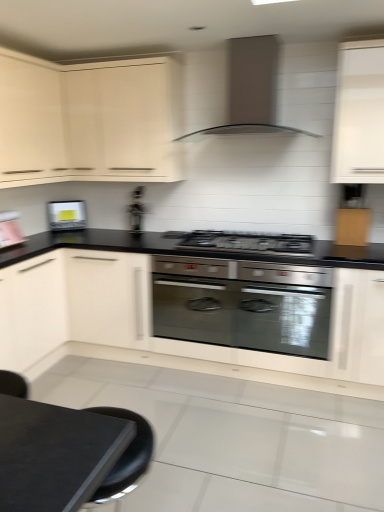
This screenshot has height=512, width=384. What do you see at coordinates (89, 120) in the screenshot?
I see `matte cream cabinet at upper left, arranged as the 2th cabinetry when viewed from the right` at bounding box center [89, 120].

Locate an element on the screen. The height and width of the screenshot is (512, 384). matte white cabinet at upper left, which appears as the 3th cabinetry when viewed from the right is located at coordinates (30, 120).

I want to click on matte black table at lower left, so click(55, 454).

From a real-world perspective, is matte white cabinet at upper left, which appears as the 3th cabinetry when viewed from the right, above or below white matte cabinet at lower left, placed as the 4th cabinetry when sorted from right to left?

matte white cabinet at upper left, which appears as the 3th cabinetry when viewed from the right, is situated higher than white matte cabinet at lower left, placed as the 4th cabinetry when sorted from right to left, in the real world.

Could you tell me if matte white cabinet at upper left, which ranks as the second cabinetry in left-to-right order, is facing white matte cabinet at lower left, which appears as the first cabinetry when viewed from the left?

No, matte white cabinet at upper left, which ranks as the second cabinetry in left-to-right order, does not turn towards white matte cabinet at lower left, which appears as the first cabinetry when viewed from the left.

Considering the positions of points (3, 86) and (109, 337), is point (3, 86) closer to camera compared to point (109, 337)?

Yes, point (3, 86) is in front of point (109, 337).

From the image's perspective, is matte white cabinet at upper left, which ranks as the second cabinetry in left-to-right order, below white matte cabinet at lower left, placed as the 4th cabinetry when sorted from right to left?

No, from the image's perspective, matte white cabinet at upper left, which ranks as the second cabinetry in left-to-right order, is not beneath white matte cabinet at lower left, placed as the 4th cabinetry when sorted from right to left.

Considering the sizes of objects matte black table at lower left and white matte cabinet at lower left, placed as the 4th cabinetry when sorted from right to left, in the image provided, who is bigger, matte black table at lower left or white matte cabinet at lower left, placed as the 4th cabinetry when sorted from right to left,?

With larger size is white matte cabinet at lower left, placed as the 4th cabinetry when sorted from right to left.

How far apart are matte black table at lower left and white matte cabinet at lower left, placed as the 4th cabinetry when sorted from right to left?

1.86 meters.

What are the coordinates of `the 3rd cabinetry to the left when counting from the matte black table at lower left` in the screenshot? It's located at (73, 303).

Is matte black table at lower left oriented away from white matte cabinet at lower left, placed as the 4th cabinetry when sorted from right to left?

No, matte black table at lower left is not facing away from white matte cabinet at lower left, placed as the 4th cabinetry when sorted from right to left.

In order to click on home appliance behind the matte black table at lower left in this screenshot , I will do `click(246, 90)`.

Looking at this image, who is smaller, satin metallic range hood at upper center or matte black table at lower left?

matte black table at lower left is smaller.

Who is more distant, satin metallic range hood at upper center or matte black table at lower left?

satin metallic range hood at upper center is more distant.

Which is in front, point (261, 57) or point (74, 454)?

Point (74, 454)

Does matte white cabinet at upper left, which appears as the 3th cabinetry when viewed from the right, lie behind satin metallic range hood at upper center?

No.

From a real-world perspective, is matte white cabinet at upper left, which ranks as the second cabinetry in left-to-right order, positioned under satin metallic range hood at upper center based on gravity?

Yes, from a real-world perspective, matte white cabinet at upper left, which ranks as the second cabinetry in left-to-right order, is beneath satin metallic range hood at upper center.

Would you say satin metallic range hood at upper center is part of matte white cabinet at upper left, which ranks as the second cabinetry in left-to-right order,'s contents?

No, satin metallic range hood at upper center is not inside matte white cabinet at upper left, which ranks as the second cabinetry in left-to-right order.

At what (x,y) coordinates should I click in order to perform the action: click on cabinetry below the matte silver toaster at left (from the image's perspective). Please return your answer as a coordinate pair (x, y). This screenshot has height=512, width=384. Looking at the image, I should click on (73, 303).

Is white matte cabinet at lower left, which appears as the first cabinetry when viewed from the left, looking in the opposite direction of matte silver toaster at left?

white matte cabinet at lower left, which appears as the first cabinetry when viewed from the left, does not have its back to matte silver toaster at left.

Is matte silver toaster at left inside white matte cabinet at lower left, placed as the 4th cabinetry when sorted from right to left?

No, white matte cabinet at lower left, placed as the 4th cabinetry when sorted from right to left, does not contain matte silver toaster at left.

Can you confirm if white matte cabinet at lower left, which appears as the first cabinetry when viewed from the left, is taller than matte silver toaster at left?

Yes, white matte cabinet at lower left, which appears as the first cabinetry when viewed from the left, is taller than matte silver toaster at left.

Does matte silver toaster at left have a lesser width compared to white matte cabinet at upper right, positioned as the 1th cabinetry in right-to-left order?

Indeed, matte silver toaster at left has a lesser width compared to white matte cabinet at upper right, positioned as the 1th cabinetry in right-to-left order.

In terms of size, does matte silver toaster at left appear bigger or smaller than white matte cabinet at upper right, positioned as the 1th cabinetry in right-to-left order?

Considering their sizes, matte silver toaster at left takes up less space than white matte cabinet at upper right, positioned as the 1th cabinetry in right-to-left order.

Considering the positions of objects matte silver toaster at left and white matte cabinet at upper right, positioned as the 1th cabinetry in right-to-left order, in the image provided, who is more to the left, matte silver toaster at left or white matte cabinet at upper right, positioned as the 1th cabinetry in right-to-left order,?

Positioned to the left is matte silver toaster at left.

Choose the correct answer: Is matte silver toaster at left inside white matte cabinet at upper right, positioned as the 1th cabinetry in right-to-left order, or outside it?

matte silver toaster at left lies outside white matte cabinet at upper right, positioned as the 1th cabinetry in right-to-left order.

Do you think matte black table at lower left is within matte silver toaster at left, or outside of it?

The correct answer is: outside.

Could you tell me if matte black table at lower left is facing matte silver toaster at left?

No.

Who is shorter, matte black table at lower left or matte silver toaster at left?

Standing shorter between the two is matte silver toaster at left.

Based on their positions, is matte black table at lower left located to the left or right of matte silver toaster at left?

In the image, matte black table at lower left appears on the right side of matte silver toaster at left.

This screenshot has width=384, height=512. Identify the location of cabinetry that is the 2nd object located below the matte white cabinet at upper left, which appears as the 3th cabinetry when viewed from the right (from the image's perspective). (73, 303).

This screenshot has width=384, height=512. I want to click on the 3rd cabinetry to the left of the matte black table at lower left, counting from the anchor's position, so click(x=73, y=303).

Looking at the image, which one is located further to satin metallic range hood at upper center, matte white cabinet at upper left, which appears as the 3th cabinetry when viewed from the right, or matte silver toaster at left?

matte silver toaster at left.

From the image, which object appears to be farther from white matte cabinet at lower left, placed as the 4th cabinetry when sorted from right to left, satin black gas stove at center or satin metallic range hood at upper center?

Among the two, satin metallic range hood at upper center is located further to white matte cabinet at lower left, placed as the 4th cabinetry when sorted from right to left.

From the image, which object appears to be nearer to matte white cabinet at upper left, which ranks as the second cabinetry in left-to-right order, metallic silver toaster at center or white matte cabinet at lower left, which appears as the first cabinetry when viewed from the left?

Based on the image, white matte cabinet at lower left, which appears as the first cabinetry when viewed from the left, appears to be nearer to matte white cabinet at upper left, which ranks as the second cabinetry in left-to-right order.

Based on their spatial positions, is metallic silver toaster at center or satin black gas stove at center closer to satin metallic range hood at upper center?

satin black gas stove at center is closer to satin metallic range hood at upper center.

Considering their positions, is satin black gas stove at center positioned closer to metallic silver toaster at center than satin metallic range hood at upper center?

satin black gas stove at center lies closer to metallic silver toaster at center than the other object.

Estimate the real-world distances between objects in this image. Which object is further from satin black gas stove at center, matte white cabinet at upper left, which ranks as the second cabinetry in left-to-right order, or white matte cabinet at upper right, positioned as the 1th cabinetry in right-to-left order?

matte white cabinet at upper left, which ranks as the second cabinetry in left-to-right order, lies further to satin black gas stove at center than the other object.

When comparing their distances from satin black gas stove at center, does metallic silver toaster at center or matte cream cabinet at upper left, which appears as the 3th cabinetry when viewed from the left, seem closer?

The object closer to satin black gas stove at center is metallic silver toaster at center.

Considering their positions, is white matte cabinet at lower left, placed as the 4th cabinetry when sorted from right to left, positioned further to satin black gas stove at center than matte white cabinet at upper left, which ranks as the second cabinetry in left-to-right order?

The object further to satin black gas stove at center is matte white cabinet at upper left, which ranks as the second cabinetry in left-to-right order.

Find the location of a particular element. The height and width of the screenshot is (512, 384). appliance between matte white cabinet at upper left, which appears as the 3th cabinetry when viewed from the right, and satin black gas stove at center from left to right is located at coordinates (136, 211).

Locate an element on the screen. The image size is (384, 512). appliance that lies between satin metallic range hood at upper center and satin black gas stove at center from top to bottom is located at coordinates (136, 211).

Find the location of a particular element. appliance between white matte cabinet at lower left, which appears as the first cabinetry when viewed from the left, and white matte cabinet at upper right, placed as the 4th cabinetry when sorted from left to right is located at coordinates (136, 211).

Where is `appliance located between matte white cabinet at upper left, which ranks as the second cabinetry in left-to-right order, and white matte cabinet at upper right, positioned as the 1th cabinetry in right-to-left order, in the left-right direction`? The height and width of the screenshot is (512, 384). appliance located between matte white cabinet at upper left, which ranks as the second cabinetry in left-to-right order, and white matte cabinet at upper right, positioned as the 1th cabinetry in right-to-left order, in the left-right direction is located at coordinates (136, 211).